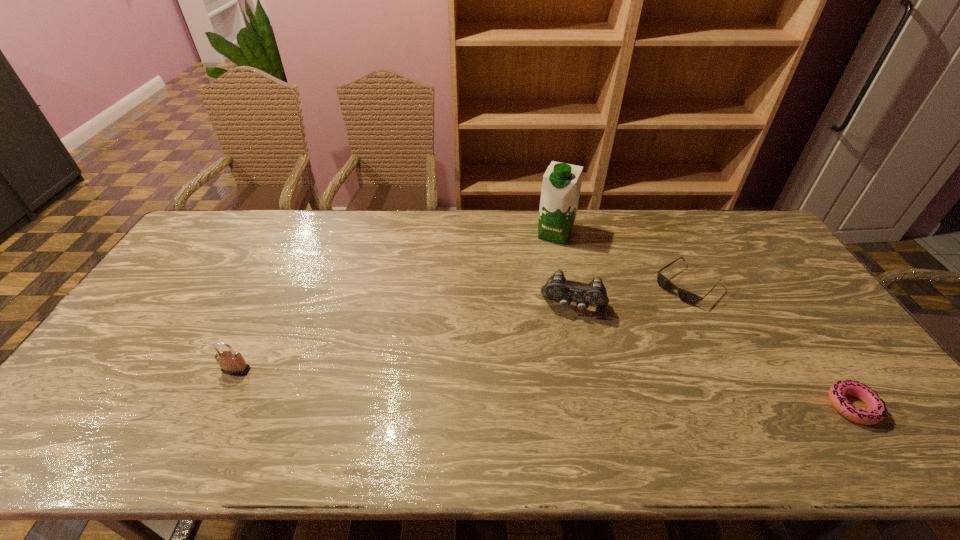
The image size is (960, 540). I want to click on the fourth farthest object, so click(x=232, y=363).

Find the location of a particular element. padlock is located at coordinates (232, 363).

Identify the location of doughnut. (876, 412).

Image resolution: width=960 pixels, height=540 pixels. Identify the location of the rightmost object. (876, 412).

Find the location of `sunglasses`. sunglasses is located at coordinates (687, 297).

You are a GUI agent. You are given a task and a screenshot of the screen. Output one action in this format:
    pyautogui.click(x=<x>, y=<y>)
    Task: Click on the farthest object
    Image resolution: width=960 pixels, height=540 pixels.
    Given the screenshot: What is the action you would take?
    pyautogui.click(x=562, y=182)

Image resolution: width=960 pixels, height=540 pixels. Identify the location of the tallest object. (562, 182).

Locate an element on the screen. control is located at coordinates (594, 294).

Identify the location of free space located on the right of the leftmost object. (347, 370).

Locate an element on the screen. The height and width of the screenshot is (540, 960). vacant space located 0.180m on the left of the rightmost object is located at coordinates (755, 406).